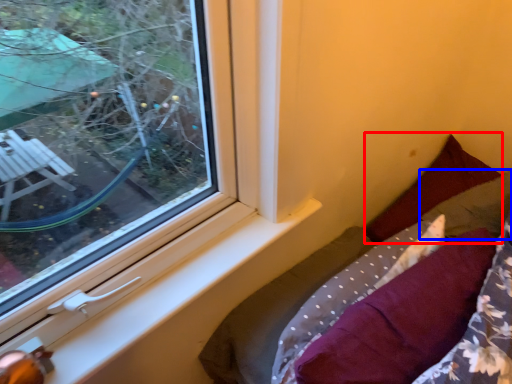
Question: Which point is closer to the camera, pillow (highlighted by a red box) or pillow (highlighted by a blue box)?

Choices:
 (A) pillow
 (B) pillow

Answer: (A)